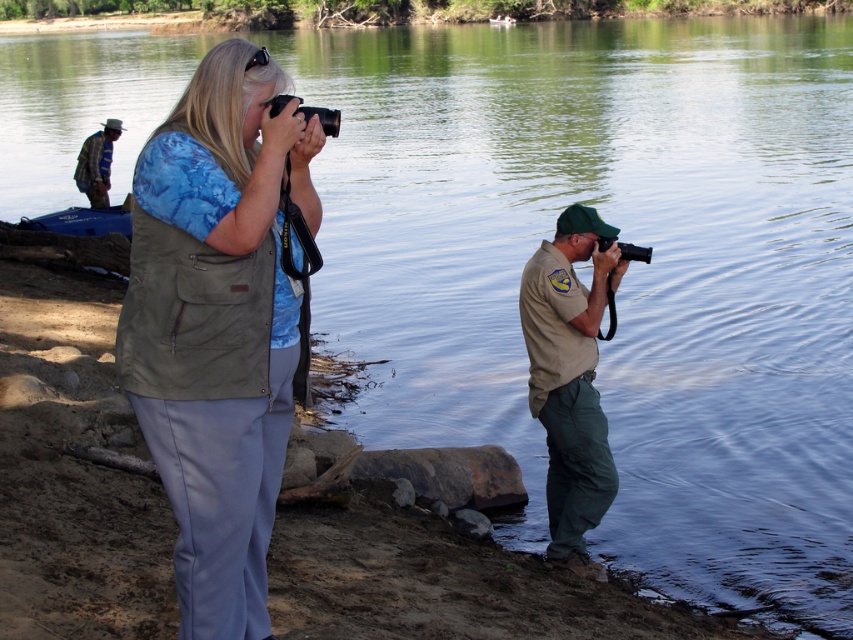
How far apart are matte khaki vest at center and khaki uniform at right?

matte khaki vest at center is 2.94 meters away from khaki uniform at right.

Can you confirm if matte khaki vest at center is positioned to the left of khaki uniform at right?

Correct, you'll find matte khaki vest at center to the left of khaki uniform at right.

Where is `matte khaki vest at center`? This screenshot has height=640, width=853. matte khaki vest at center is located at coordinates (218, 326).

Image resolution: width=853 pixels, height=640 pixels. In order to click on matte khaki vest at center in this screenshot , I will do `click(218, 326)`.

Between point (260, 525) and point (115, 131), which one is positioned in front?

Positioned in front is point (260, 525).

Is matte khaki vest at center shorter than striped fabric shirt at upper left?

Incorrect, matte khaki vest at center's height does not fall short of striped fabric shirt at upper left's.

Between point (144, 289) and point (96, 189), which one is positioned behind?

The point (96, 189) is behind.

Locate an element on the screen. The height and width of the screenshot is (640, 853). matte khaki vest at center is located at coordinates (218, 326).

How much distance is there between khaki uniform at right and striped fabric shirt at upper left?

khaki uniform at right and striped fabric shirt at upper left are 12.68 meters apart.

Is khaki uniform at right to the left of striped fabric shirt at upper left from the viewer's perspective?

No, khaki uniform at right is not to the left of striped fabric shirt at upper left.

I want to click on khaki uniform at right, so click(x=570, y=378).

You are a GUI agent. You are given a task and a screenshot of the screen. Output one action in this format:
    pyautogui.click(x=<x>, y=<y>)
    Task: Click on the khaki uniform at right
    The image size is (853, 640).
    Given the screenshot: What is the action you would take?
    pyautogui.click(x=570, y=378)